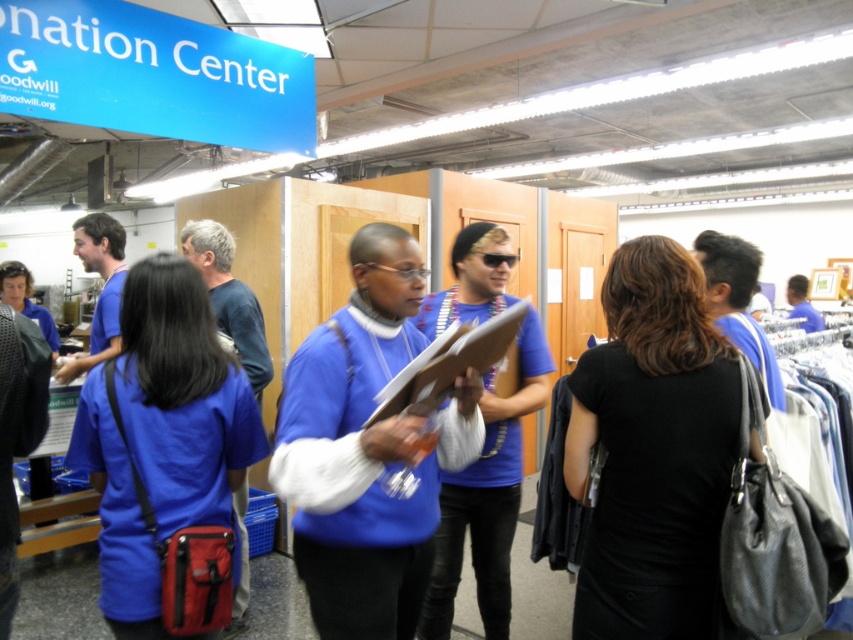
Question: Does black leather purse at center appear under matte blue shirt at center?

Choices:
 (A) no
 (B) yes

Answer: (A)

Question: Is black leather purse at center wider than matte blue shirt at center?

Choices:
 (A) yes
 (B) no

Answer: (B)

Question: Does black leather purse at center appear under matte blue shirt at center?

Choices:
 (A) yes
 (B) no

Answer: (B)

Question: Which of the following is the farthest from the observer?

Choices:
 (A) (213, 380)
 (B) (665, 490)

Answer: (A)

Question: Which point is farther from the camera taking this photo?

Choices:
 (A) (146, 332)
 (B) (602, 308)

Answer: (B)